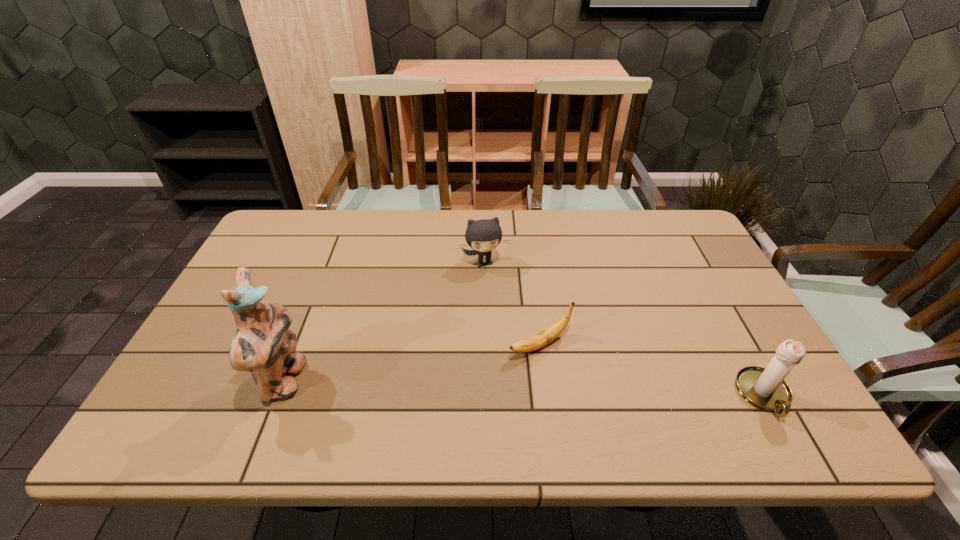
I want to click on free spot between the rightmost object and the banana, so click(x=652, y=370).

This screenshot has height=540, width=960. What are the coordinates of `vacant space that's between the rightmost object and the kitten` in the screenshot? It's located at (624, 329).

In order to click on unoccupied area between the banana and the kitten in this screenshot , I will do `click(512, 303)`.

Find the location of a particular element. This screenshot has width=960, height=540. unoccupied position between the leftmost object and the farthest object is located at coordinates (384, 322).

The height and width of the screenshot is (540, 960). Identify the location of object identified as the second closest to the farthest object. (263, 345).

Select which object is the third closest to the figurine. Please provide its 2D coordinates. Your answer should be formatted as a tuple, i.e. [(x, y)], where the tuple contains the x and y coordinates of a point satisfying the conditions above.

[(766, 389)]

Image resolution: width=960 pixels, height=540 pixels. What are the coordinates of `vacant space that satisfies the following two spatial constraints: 1. on the front side of the banana; 2. on the left side of the farthest object` in the screenshot? It's located at (485, 345).